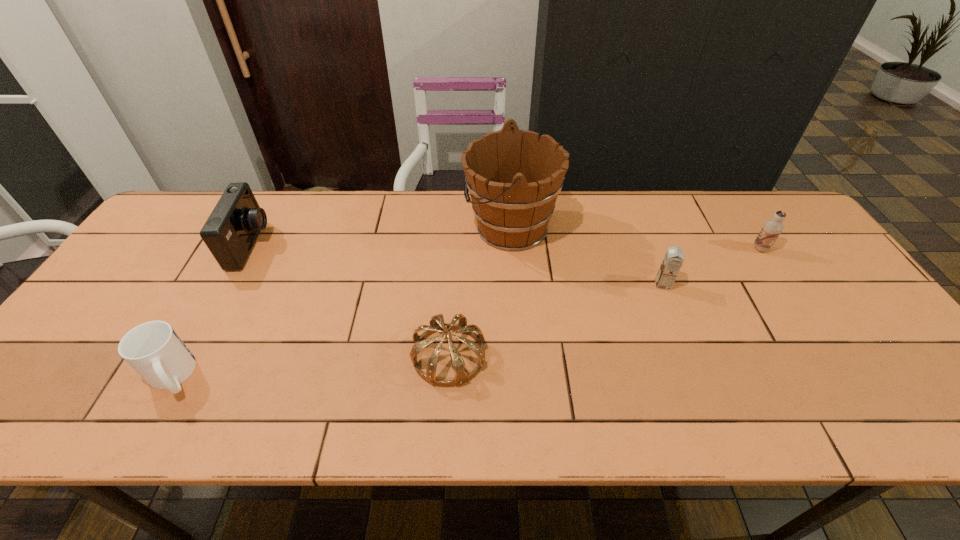
This screenshot has width=960, height=540. In order to click on vacant area situated 0.270m with the handle on the tallest object in this screenshot , I will do `click(374, 227)`.

I want to click on vacant area situated on the front-facing side of the camera, so click(378, 246).

Where is `vacant space located on the left of the farther chocolate milk`? The height and width of the screenshot is (540, 960). vacant space located on the left of the farther chocolate milk is located at coordinates (652, 249).

At what (x,y) coordinates should I click in order to perform the action: click on free space located 0.380m on the back of the left chocolate milk. Please return your answer as a coordinate pair (x, y). Image resolution: width=960 pixels, height=540 pixels. Looking at the image, I should click on (628, 195).

I want to click on free space located on the right of the mug, so click(293, 376).

Identify the location of vacant space situated on the back of the tiara. (453, 280).

Locate an element on the screen. The height and width of the screenshot is (540, 960). wine bucket located at the far edge is located at coordinates (513, 178).

This screenshot has height=540, width=960. What are the coordinates of `camera at the far edge` in the screenshot? It's located at (230, 232).

What are the coordinates of `object that is at the near edge` in the screenshot? It's located at tap(153, 349).

The image size is (960, 540). Find the location of `object present at the right edge`. object present at the right edge is located at coordinates (772, 228).